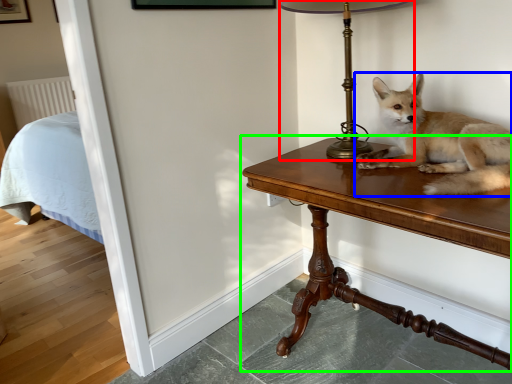
Question: Considering the real-world distances, which object is farthest from table lamp (highlighted by a red box)? dog (highlighted by a blue box) or table (highlighted by a green box)?

Choices:
 (A) dog
 (B) table

Answer: (B)